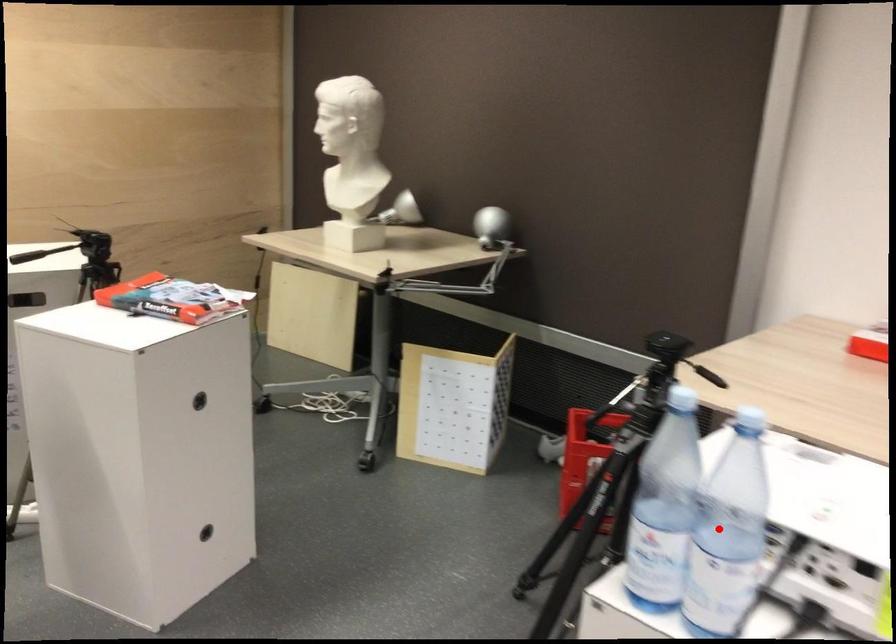
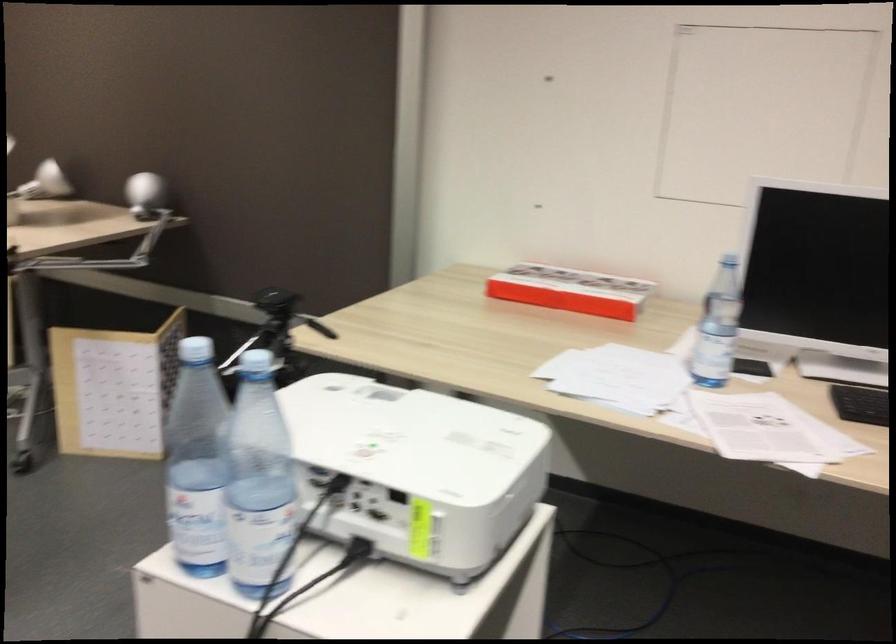
The point at the highlighted location is marked in the first image. Where is the corresponding point in the second image?

(259, 482)